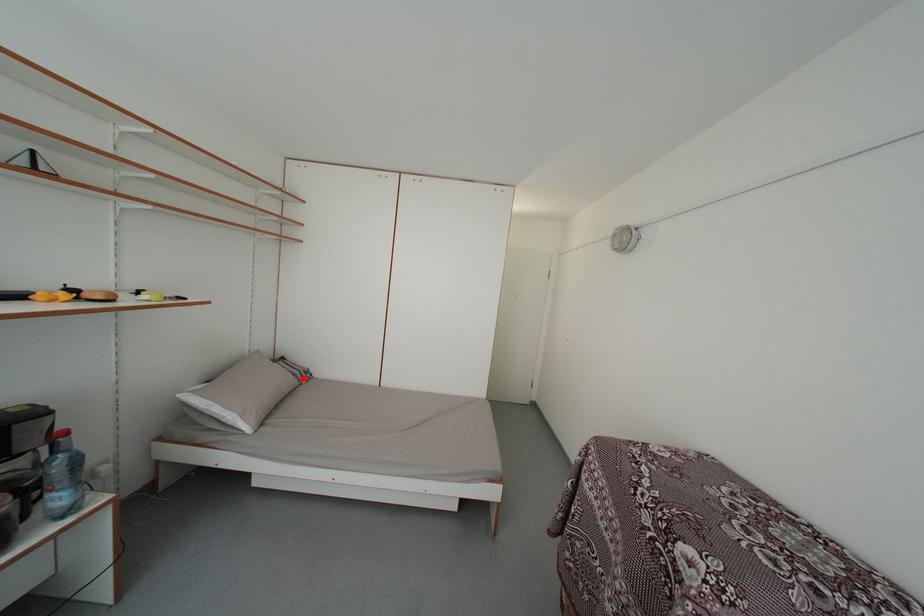
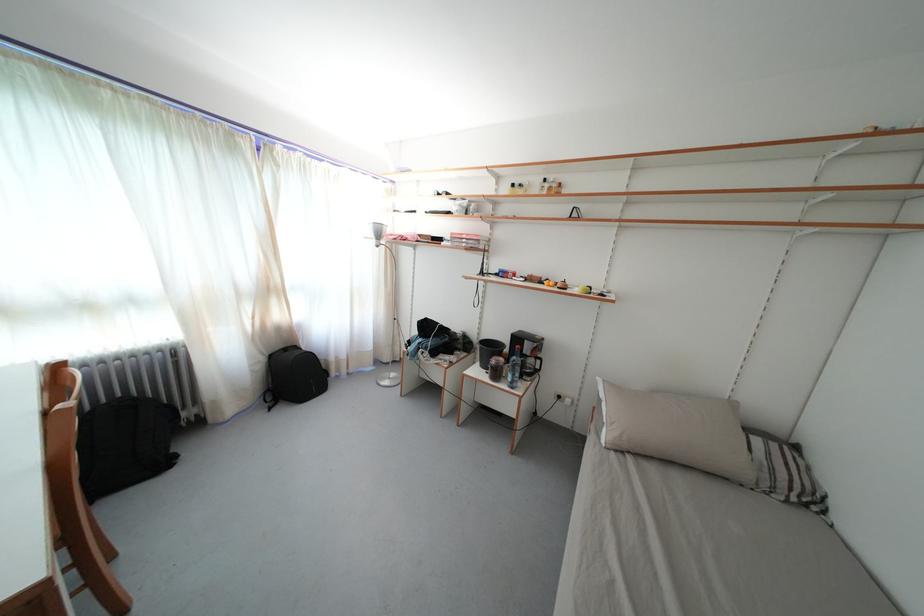
Question: I am providing you with two images of the same scene from different viewpoints. A red point is shown in image1. For the corresponding object point in image2, is it positioned nearer or farther from the camera?

Choices:
 (A) Nearer
 (B) Farther

Answer: (A)